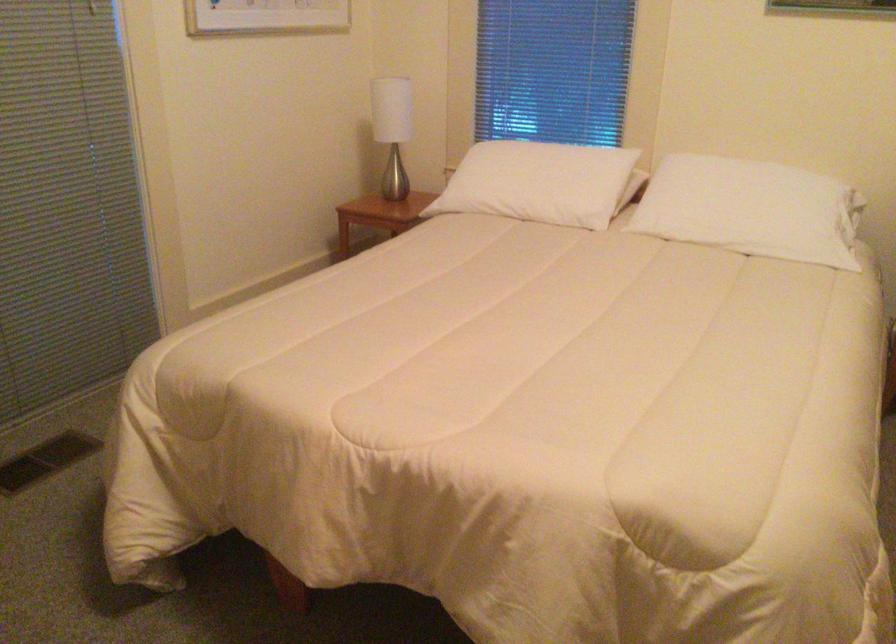
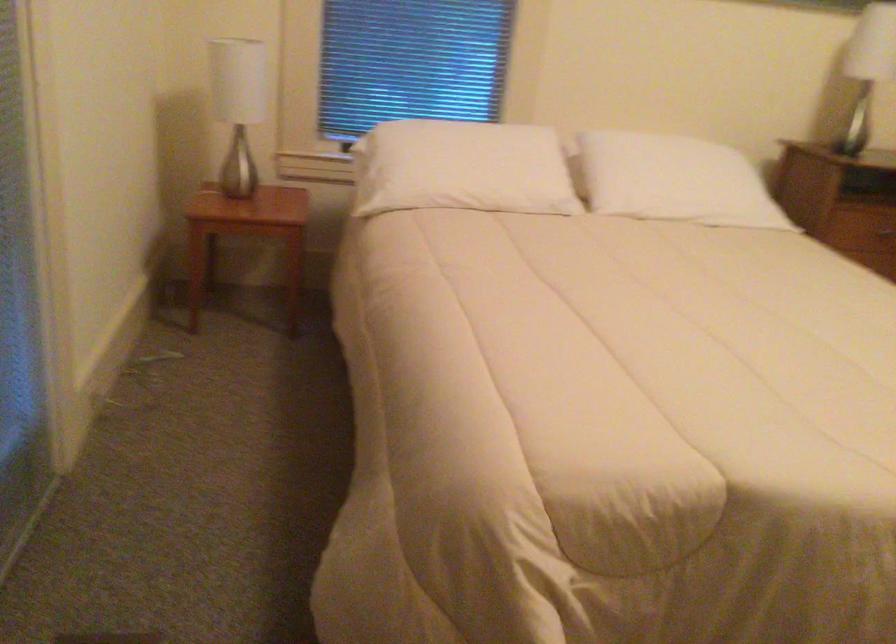
Find the pixel in the second image that matches point 506,180 in the first image.

(462, 167)